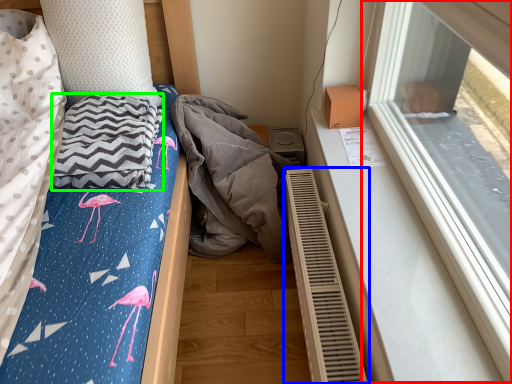
Question: Based on their relative distances, which object is farther from window (highlighted by a red box)? Choose from radiator (highlighted by a blue box) and blanket (highlighted by a green box).

Choices:
 (A) radiator
 (B) blanket

Answer: (B)